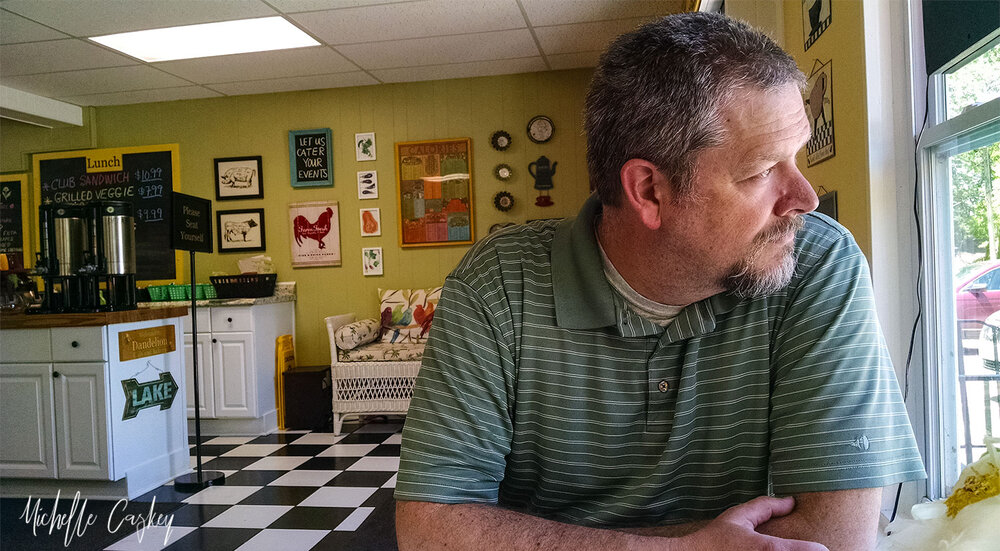
Image resolution: width=1000 pixels, height=551 pixels. Identify the location of bench. (383, 360).